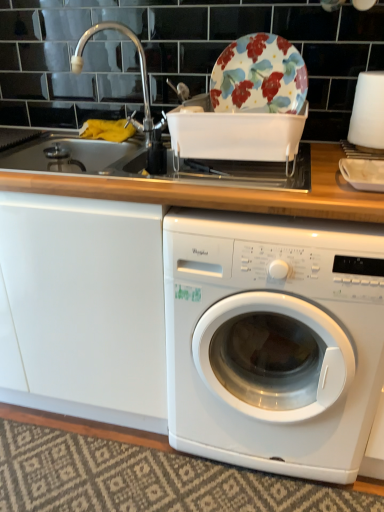
Question: Choose the correct answer: Is silver metallic faucet at upper left inside white plastic washing machine at center or outside it?

Choices:
 (A) inside
 (B) outside

Answer: (B)

Question: Considering the positions of silver metallic faucet at upper left and white plastic washing machine at center in the image, is silver metallic faucet at upper left wider or thinner than white plastic washing machine at center?

Choices:
 (A) wide
 (B) thin

Answer: (B)

Question: Which of these objects is positioned closest to the silver metallic faucet at upper left?

Choices:
 (A) white matte plate at right
 (B) white plastic washing machine at center
 (C) floral ceramic plate at upper center

Answer: (C)

Question: Estimate the real-world distances between objects in this image. Which object is closer to the white matte plate at right?

Choices:
 (A) floral ceramic plate at upper center
 (B) silver metallic faucet at upper left
 (C) white plastic washing machine at center

Answer: (A)